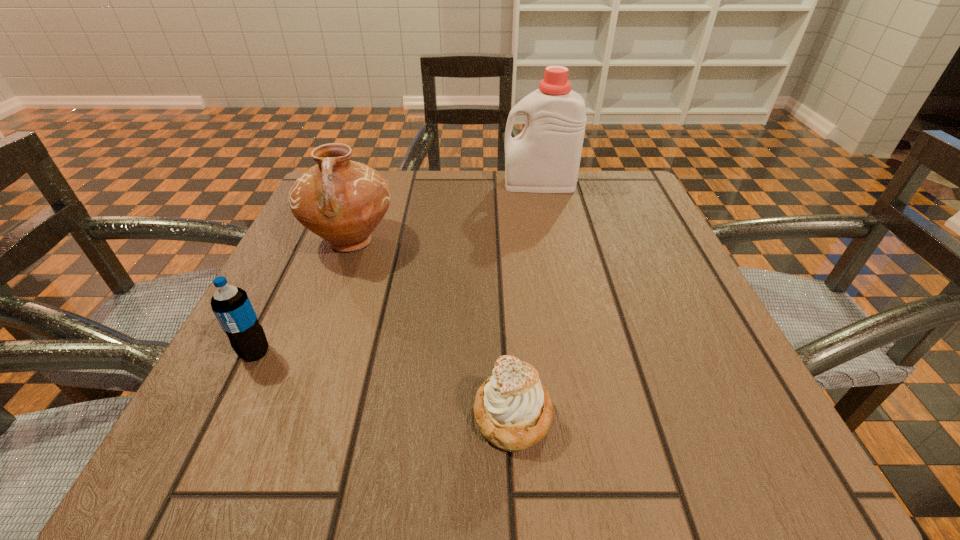
Identify the location of free space located on the handle side of the tallest object. Image resolution: width=960 pixels, height=540 pixels. (x=452, y=184).

Locate an element on the screen. The image size is (960, 540). vacant space located 0.090m on the side of the pottery with the handle is located at coordinates (327, 305).

I want to click on vacant area situated on the right of the soda bottle, so click(432, 353).

This screenshot has width=960, height=540. I want to click on vacant space situated on the back of the nearest object, so click(504, 272).

Locate an element on the screen. The height and width of the screenshot is (540, 960). detergent present at the far edge is located at coordinates (545, 157).

This screenshot has width=960, height=540. In order to click on pottery positioned at the far edge in this screenshot , I will do `click(342, 201)`.

The height and width of the screenshot is (540, 960). Identify the location of object located at the near edge. (513, 410).

Image resolution: width=960 pixels, height=540 pixels. In order to click on pottery that is at the left edge in this screenshot , I will do `click(342, 201)`.

This screenshot has height=540, width=960. I want to click on soda bottle located in the left edge section of the desktop, so click(231, 305).

At what (x,y) coordinates should I click in order to perform the action: click on object that is at the right edge. Please return your answer as a coordinate pair (x, y). The width and height of the screenshot is (960, 540). Looking at the image, I should click on (545, 157).